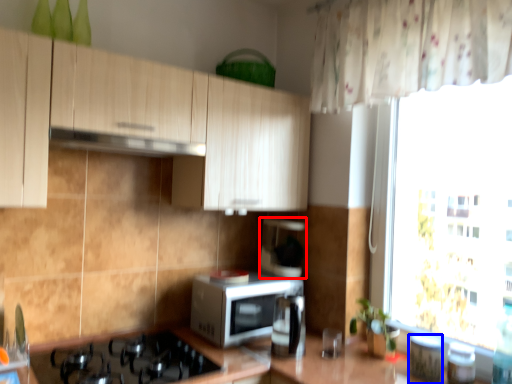
Question: Which object appears farthest to the camera in this image, coffee machine (highlighted by a red box) or appliance (highlighted by a blue box)?

Choices:
 (A) coffee machine
 (B) appliance

Answer: (A)